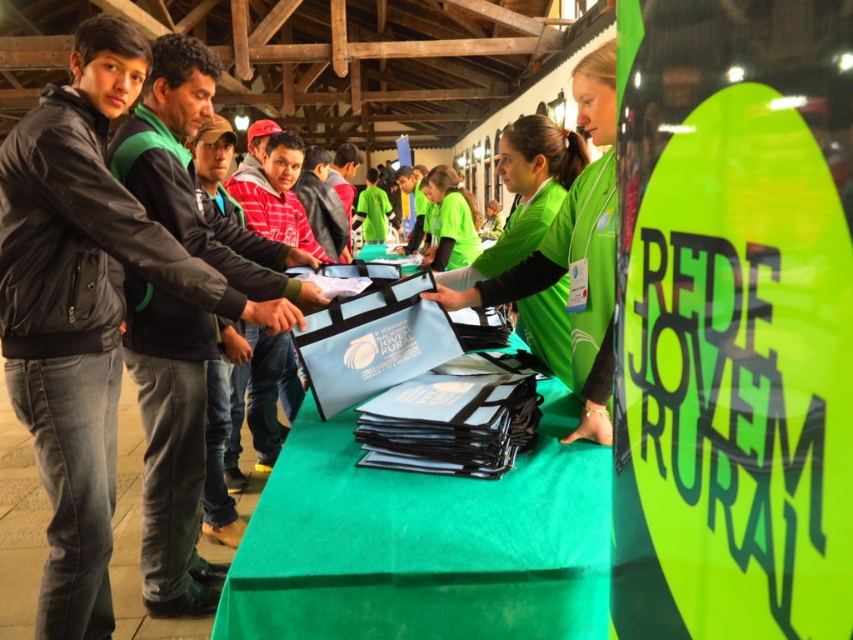
From the picture: You are at the event and need to find the volunteer wearing a green fleece jacket at left. Since you see the green fabric shirt at center, where should you look relative to that person?

The green fleece jacket at left is to the left of the green fabric shirt at center, so you should look to the left of the person wearing the green fabric shirt at center to find the volunteer with the green fleece jacket at left.

You are organizing a community event and need to ensure that the volunteers have enough space to move around. You notice two volunteers wearing the green matte vest at center and the green fabric shirt at center. Which volunteer has clothing that might require more space to move comfortably?

The green matte vest at center has a larger width than the green fabric shirt at center, so the volunteer wearing the green matte vest at center would need more space to move comfortably.